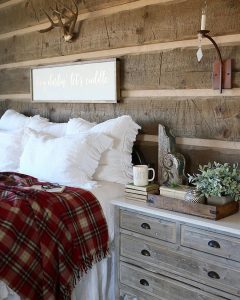
Find the location of `blanket throw plaid`. blanket throw plaid is located at coordinates (49, 236).